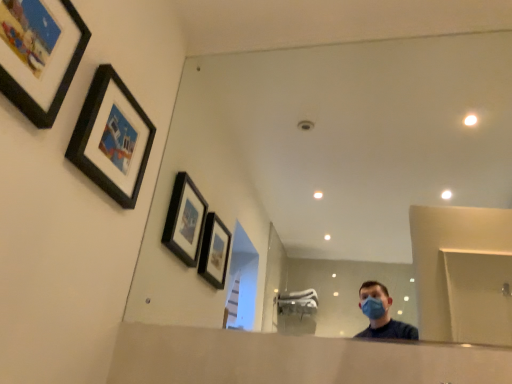
Describe the element at coordinates (59, 85) in the screenshot. I see `matte black picture frame at upper left, arranged as the 2th picture frame when viewed from the back` at that location.

What do you see at coordinates (112, 138) in the screenshot?
I see `black matte picture frame at upper left, the first picture frame in the back-to-front sequence` at bounding box center [112, 138].

The width and height of the screenshot is (512, 384). I want to click on matte black picture frame at upper left, arranged as the 1th picture frame when viewed from the front, so click(59, 85).

Which object is closer to the camera taking this photo, clear glass mirror at center or black matte picture frame at upper left, which is the second picture frame in front-to-back order?

clear glass mirror at center.

Based on the photo, considering the sizes of objects clear glass mirror at center and black matte picture frame at upper left, which is the second picture frame in front-to-back order, in the image provided, who is smaller, clear glass mirror at center or black matte picture frame at upper left, which is the second picture frame in front-to-back order,?

With smaller size is black matte picture frame at upper left, which is the second picture frame in front-to-back order.

Is clear glass mirror at center located outside black matte picture frame at upper left, which is the second picture frame in front-to-back order?

Absolutely, clear glass mirror at center is external to black matte picture frame at upper left, which is the second picture frame in front-to-back order.

At what (x,y) coordinates should I click in order to perform the action: click on the 2nd picture frame located beneath the clear glass mirror at center (from a real-world perspective). Please return your answer as a coordinate pair (x, y). The image size is (512, 384). Looking at the image, I should click on (112, 138).

Considering the sizes of objects black matte picture frame at upper left, the first picture frame in the back-to-front sequence, and clear glass mirror at center in the image provided, who is bigger, black matte picture frame at upper left, the first picture frame in the back-to-front sequence, or clear glass mirror at center?

clear glass mirror at center.

Which is in front, point (77, 158) or point (483, 106)?

The point (77, 158) is closer.

Is black matte picture frame at upper left, which is the second picture frame in front-to-back order, at the right side of clear glass mirror at center?

In fact, black matte picture frame at upper left, which is the second picture frame in front-to-back order, is to the left of clear glass mirror at center.

The image size is (512, 384). What are the coordinates of `mirror on the right of black matte picture frame at upper left, the first picture frame in the back-to-front sequence` in the screenshot? It's located at (330, 156).

Is matte black picture frame at upper left, arranged as the 1th picture frame when viewed from the front, wider or thinner than black matte picture frame at upper left, which is the second picture frame in front-to-back order?

Considering their sizes, matte black picture frame at upper left, arranged as the 1th picture frame when viewed from the front, looks broader than black matte picture frame at upper left, which is the second picture frame in front-to-back order.

Is matte black picture frame at upper left, arranged as the 1th picture frame when viewed from the front, not close to black matte picture frame at upper left, the first picture frame in the back-to-front sequence?

No, matte black picture frame at upper left, arranged as the 1th picture frame when viewed from the front, is in close proximity to black matte picture frame at upper left, the first picture frame in the back-to-front sequence.

From the image's perspective, is matte black picture frame at upper left, arranged as the 1th picture frame when viewed from the front, on black matte picture frame at upper left, the first picture frame in the back-to-front sequence?

Indeed, from the image's perspective, matte black picture frame at upper left, arranged as the 1th picture frame when viewed from the front, is shown above black matte picture frame at upper left, the first picture frame in the back-to-front sequence.

Does matte black picture frame at upper left, arranged as the 2th picture frame when viewed from the back, appear on the right side of black matte picture frame at upper left, which is the second picture frame in front-to-back order?

No, matte black picture frame at upper left, arranged as the 2th picture frame when viewed from the back, is not to the right of black matte picture frame at upper left, which is the second picture frame in front-to-back order.

Looking at this image, how far apart are clear glass mirror at center and matte black picture frame at upper left, arranged as the 2th picture frame when viewed from the back?

clear glass mirror at center and matte black picture frame at upper left, arranged as the 2th picture frame when viewed from the back, are 5.64 feet apart.

Which is more to the left, clear glass mirror at center or matte black picture frame at upper left, arranged as the 1th picture frame when viewed from the front?

matte black picture frame at upper left, arranged as the 1th picture frame when viewed from the front, is more to the left.

Where is `picture frame in front of the clear glass mirror at center`? picture frame in front of the clear glass mirror at center is located at coordinates (59, 85).

Considering the relative sizes of clear glass mirror at center and matte black picture frame at upper left, arranged as the 2th picture frame when viewed from the back, in the image provided, is clear glass mirror at center taller than matte black picture frame at upper left, arranged as the 2th picture frame when viewed from the back,?

Yes.

Is point (63, 97) less distant than point (502, 60)?

Yes.

In the scene shown: Does matte black picture frame at upper left, arranged as the 1th picture frame when viewed from the front, have a greater height compared to clear glass mirror at center?

No.

From a real-world perspective, between matte black picture frame at upper left, arranged as the 1th picture frame when viewed from the front, and clear glass mirror at center, who is vertically higher?

clear glass mirror at center, from a real-world perspective.

Is matte black picture frame at upper left, arranged as the 1th picture frame when viewed from the front, oriented towards clear glass mirror at center?

No, matte black picture frame at upper left, arranged as the 1th picture frame when viewed from the front, is not turned towards clear glass mirror at center.

From the image's perspective, which is above, black matte picture frame at upper left, which is the second picture frame in front-to-back order, or matte black picture frame at upper left, arranged as the 2th picture frame when viewed from the back?

matte black picture frame at upper left, arranged as the 2th picture frame when viewed from the back, is shown above in the image.

Which of these two, black matte picture frame at upper left, which is the second picture frame in front-to-back order, or matte black picture frame at upper left, arranged as the 2th picture frame when viewed from the back, is wider?

matte black picture frame at upper left, arranged as the 2th picture frame when viewed from the back.

How many degrees apart are the facing directions of black matte picture frame at upper left, the first picture frame in the back-to-front sequence, and matte black picture frame at upper left, arranged as the 2th picture frame when viewed from the back?

The angle between the facing direction of black matte picture frame at upper left, the first picture frame in the back-to-front sequence, and the facing direction of matte black picture frame at upper left, arranged as the 2th picture frame when viewed from the back, is 1.15 degrees.

Is black matte picture frame at upper left, which is the second picture frame in front-to-back order, completely or partially outside of matte black picture frame at upper left, arranged as the 2th picture frame when viewed from the back?

Yes, black matte picture frame at upper left, which is the second picture frame in front-to-back order, is outside of matte black picture frame at upper left, arranged as the 2th picture frame when viewed from the back.

Where is `mirror that appears below the black matte picture frame at upper left, the first picture frame in the back-to-front sequence (from the image's perspective)`? mirror that appears below the black matte picture frame at upper left, the first picture frame in the back-to-front sequence (from the image's perspective) is located at coordinates (330, 156).

Locate an element on the screen. The image size is (512, 384). picture frame behind the clear glass mirror at center is located at coordinates (112, 138).

When comparing their distances from clear glass mirror at center, does matte black picture frame at upper left, arranged as the 1th picture frame when viewed from the front, or black matte picture frame at upper left, the first picture frame in the back-to-front sequence, seem further?

matte black picture frame at upper left, arranged as the 1th picture frame when viewed from the front, is further to clear glass mirror at center.

Estimate the real-world distances between objects in this image. Which object is closer to clear glass mirror at center, black matte picture frame at upper left, the first picture frame in the back-to-front sequence, or matte black picture frame at upper left, arranged as the 1th picture frame when viewed from the front?

The object closer to clear glass mirror at center is black matte picture frame at upper left, the first picture frame in the back-to-front sequence.

Estimate the real-world distances between objects in this image. Which object is further from matte black picture frame at upper left, arranged as the 1th picture frame when viewed from the front, clear glass mirror at center or black matte picture frame at upper left, the first picture frame in the back-to-front sequence?

clear glass mirror at center.

Which object lies nearer to the anchor point black matte picture frame at upper left, the first picture frame in the back-to-front sequence, matte black picture frame at upper left, arranged as the 2th picture frame when viewed from the back, or clear glass mirror at center?

Among the two, matte black picture frame at upper left, arranged as the 2th picture frame when viewed from the back, is located nearer to black matte picture frame at upper left, the first picture frame in the back-to-front sequence.

Considering their positions, is clear glass mirror at center positioned further to black matte picture frame at upper left, which is the second picture frame in front-to-back order, than matte black picture frame at upper left, arranged as the 2th picture frame when viewed from the back?

Among the two, clear glass mirror at center is located further to black matte picture frame at upper left, which is the second picture frame in front-to-back order.

Estimate the real-world distances between objects in this image. Which object is further from matte black picture frame at upper left, arranged as the 2th picture frame when viewed from the back, black matte picture frame at upper left, which is the second picture frame in front-to-back order, or clear glass mirror at center?

clear glass mirror at center.

Locate an element on the screen. picture frame between matte black picture frame at upper left, arranged as the 1th picture frame when viewed from the front, and clear glass mirror at center from left to right is located at coordinates (112, 138).